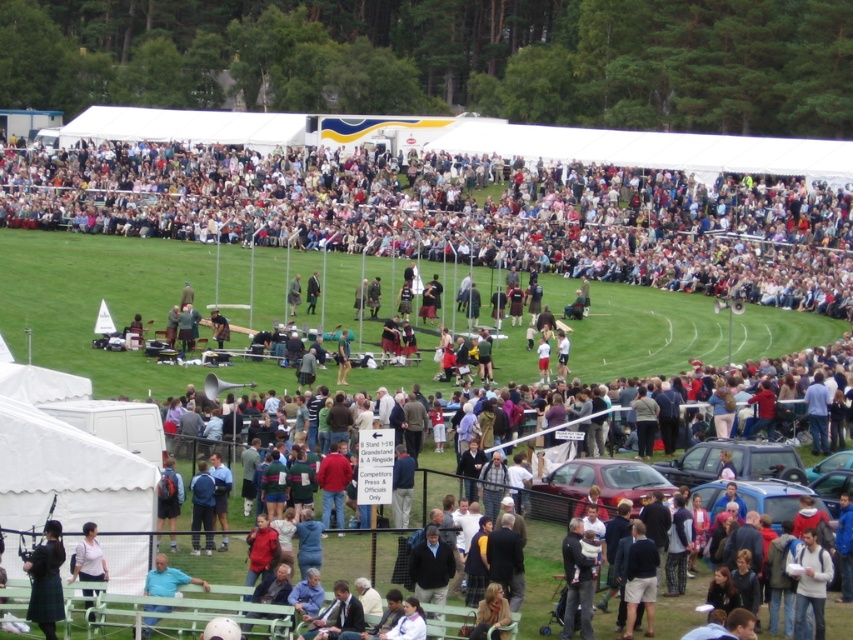
What is the color of the object located at the coordinates point (596, 484)?

The object located at point (596, 484) is matte red car at center.